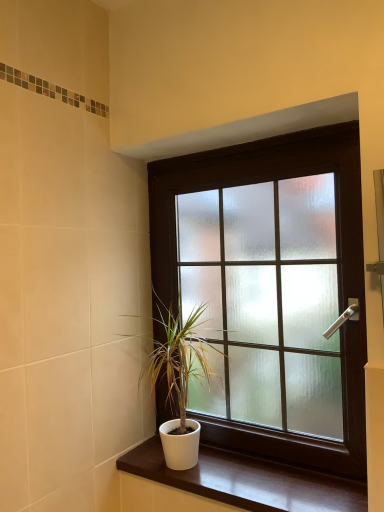
Question: Choose the correct answer: Is white matte pot at lower center inside frosted glass window at center or outside it?

Choices:
 (A) inside
 (B) outside

Answer: (A)

Question: Is white matte pot at lower center to the left or to the right of frosted glass window at center in the image?

Choices:
 (A) right
 (B) left

Answer: (B)

Question: Estimate the real-world distances between objects in this image. Which object is closer to the white matte pot at lower center?

Choices:
 (A) frosted glass window at center
 (B) white glossy wood at lower center

Answer: (A)

Question: Estimate the real-world distances between objects in this image. Which object is closer to the white glossy wood at lower center?

Choices:
 (A) frosted glass window at center
 (B) white matte pot at lower center

Answer: (B)